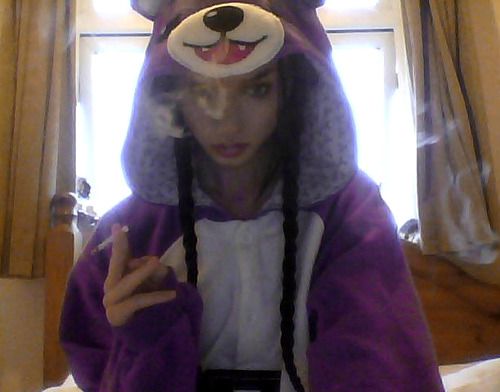
Locate an element on the screen. wall is located at coordinates (x=30, y=327).